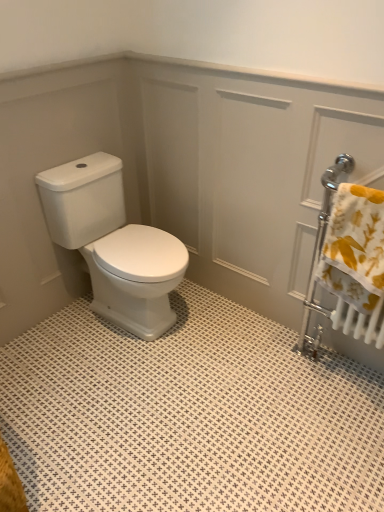
This screenshot has width=384, height=512. What are the coordinates of `white glossy toilet at center` in the screenshot? It's located at (113, 244).

Measure the distance between point (174, 285) and camera.

1.89 meters.

Identify the location of white glossy screen door at center. This screenshot has height=512, width=384. (248, 168).

Find the location of `white glossy toilet at center`. white glossy toilet at center is located at coordinates (113, 244).

From a real-world perspective, is yellow floral fabric at right over white glossy screen door at center?

Yes.

Could white glossy screen door at center be considered to be inside yellow floral fabric at right?

No, white glossy screen door at center is not a part of yellow floral fabric at right.

Is yellow floral fabric at right taller than white glossy screen door at center?

Incorrect, the height of yellow floral fabric at right is not larger of that of white glossy screen door at center.

Considering the positions of point (374, 208) and point (265, 91), is point (374, 208) closer or farther from the camera than point (265, 91)?

Point (374, 208).

From the image's perspective, which one is positioned higher, yellow floral fabric at right or white glossy toilet at center?

white glossy toilet at center.

How far apart are yellow floral fabric at right and white glossy toilet at center?

yellow floral fabric at right and white glossy toilet at center are 34.65 inches apart from each other.

Is point (365, 260) positioned in front of point (110, 291)?

Yes, point (365, 260) is closer to viewer.

From a real-world perspective, who is located lower, yellow floral fabric at right or white glossy toilet at center?

From a 3D spatial view, white glossy toilet at center is below.

Is white glossy toilet at center turned away from white glossy screen door at center?

No, white glossy toilet at center is not facing the opposite direction of white glossy screen door at center.

Is point (98, 252) more distant than point (142, 73)?

No, (98, 252) is in front of (142, 73).

Is white glossy screen door at center located within white glossy toilet at center?

Definitely not — white glossy screen door at center is not inside white glossy toilet at center.

Is white glossy toilet at center at the right side of white glossy screen door at center?

No, white glossy toilet at center is not to the right of white glossy screen door at center.

From the image's perspective, does white glossy screen door at center appear higher than white glossy toilet at center?

Indeed, from the image's perspective, white glossy screen door at center is shown above white glossy toilet at center.

Measure the distance from white glossy screen door at center to white glossy toilet at center.

white glossy screen door at center and white glossy toilet at center are 47.60 centimeters apart.

Can you confirm if white glossy screen door at center is thinner than white glossy toilet at center?

Yes, white glossy screen door at center is thinner than white glossy toilet at center.

Is white glossy screen door at center not within white glossy toilet at center?

white glossy screen door at center is positioned outside white glossy toilet at center.

Considering the relative sizes of white glossy toilet at center and yellow floral fabric at right in the image provided, is white glossy toilet at center wider than yellow floral fabric at right?

Yes.

Based on the photo, which of these two, white glossy toilet at center or yellow floral fabric at right, stands shorter?

Standing shorter between the two is yellow floral fabric at right.

Image resolution: width=384 pixels, height=512 pixels. In order to click on porcelain below the yellow floral fabric at right (from a real-world perspective) in this screenshot , I will do `click(113, 244)`.

From a real-world perspective, is white glossy screen door at center positioned above or below yellow floral fabric at right?

In terms of real-world spatial position, white glossy screen door at center is below yellow floral fabric at right.

Is white glossy screen door at center in front of or behind yellow floral fabric at right in the image?

white glossy screen door at center is positioned farther from the viewer than yellow floral fabric at right.

Does white glossy screen door at center have a greater height compared to yellow floral fabric at right?

Yes.

Locate an element on the screen. bath towel that is in front of the white glossy screen door at center is located at coordinates (354, 247).

Where is `porcelain lying on the left of yellow floral fabric at right`? This screenshot has width=384, height=512. porcelain lying on the left of yellow floral fabric at right is located at coordinates (113, 244).

Estimate the real-world distances between objects in this image. Which object is further from white glossy toilet at center, yellow floral fabric at right or white glossy screen door at center?

yellow floral fabric at right is further to white glossy toilet at center.

Looking at the image, which one is located closer to white glossy screen door at center, white glossy toilet at center or yellow floral fabric at right?

white glossy toilet at center lies closer to white glossy screen door at center than the other object.

Which object lies further to the anchor point yellow floral fabric at right, white glossy screen door at center or white glossy toilet at center?

Among the two, white glossy toilet at center is located further to yellow floral fabric at right.

Estimate the real-world distances between objects in this image. Which object is further from white glossy screen door at center, yellow floral fabric at right or white glossy toilet at center?

Among the two, yellow floral fabric at right is located further to white glossy screen door at center.

Considering their positions, is white glossy screen door at center positioned further to white glossy toilet at center than yellow floral fabric at right?

Among the two, yellow floral fabric at right is located further to white glossy toilet at center.

Looking at the image, which one is located further to yellow floral fabric at right, white glossy toilet at center or white glossy screen door at center?

Based on the image, white glossy toilet at center appears to be further to yellow floral fabric at right.

Find the location of a particular element. screen door between white glossy toilet at center and yellow floral fabric at right in the horizontal direction is located at coordinates (248, 168).